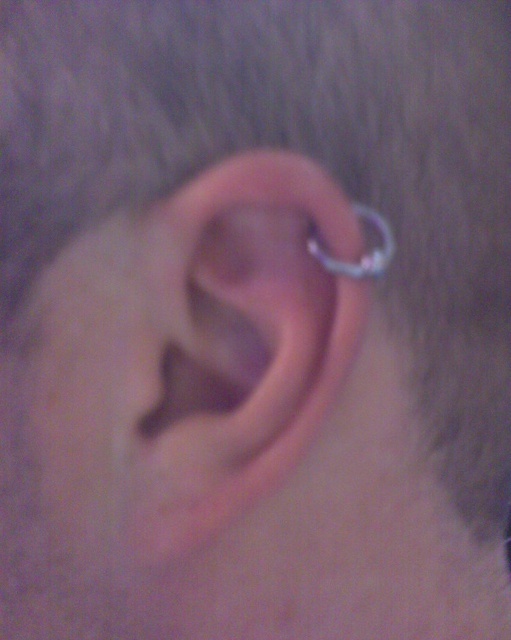
Does pink flesh-colored ear at center have a larger size compared to silver metallic hoop at ear?

Correct, pink flesh-colored ear at center is larger in size than silver metallic hoop at ear.

Does point (194, 296) come in front of point (389, 241)?

Yes.

Measure the distance between pink flesh-colored ear at center and camera.

They are 9.67 inches apart.

Find the location of a particular element. Image resolution: width=511 pixels, height=640 pixels. pink flesh-colored ear at center is located at coordinates (243, 337).